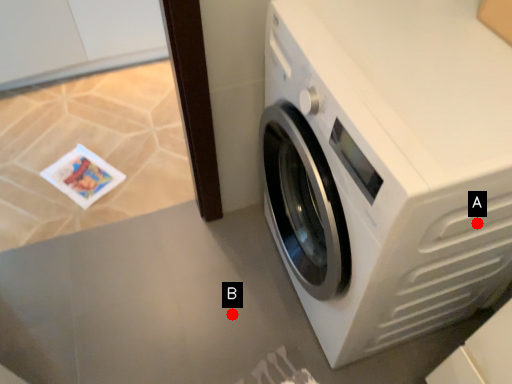
Question: Two points are circled on the image, labeled by A and B beside each circle. Which point is closer to the camera?

Choices:
 (A) A is closer
 (B) B is closer

Answer: (A)